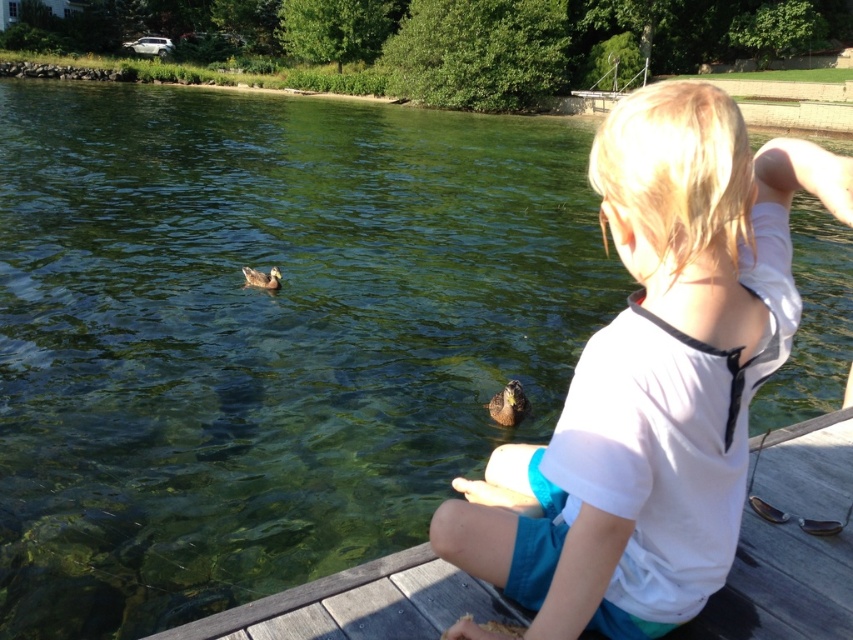
Question: Which of the following is the closest to the observer?

Choices:
 (A) brown matte duck at left
 (B) white cotton shirt at center
 (C) wooden dock at lower center

Answer: (B)

Question: Which point appears farthest from the camera in this image?

Choices:
 (A) (744, 602)
 (B) (270, 285)
 (C) (670, 294)
 (D) (502, 388)

Answer: (B)

Question: Is white cotton shirt at center smaller than brown fuzzy duck at lower center?

Choices:
 (A) yes
 (B) no

Answer: (B)

Question: Can you confirm if white cotton shirt at center is positioned to the right of brown fuzzy duck at lower center?

Choices:
 (A) yes
 (B) no

Answer: (B)

Question: Which point is closer to the camera?

Choices:
 (A) (502, 420)
 (B) (274, 282)

Answer: (A)

Question: Does wooden dock at lower center have a larger size compared to brown matte duck at left?

Choices:
 (A) yes
 (B) no

Answer: (A)